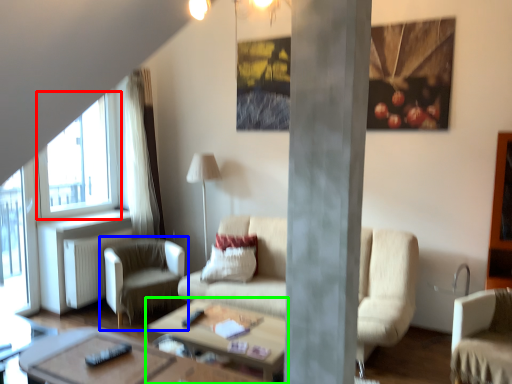
Question: Which object is the closest to the window (highlighted by a red box)? Choose among these: chair (highlighted by a blue box) or coffee table (highlighted by a green box).

Choices:
 (A) chair
 (B) coffee table

Answer: (A)